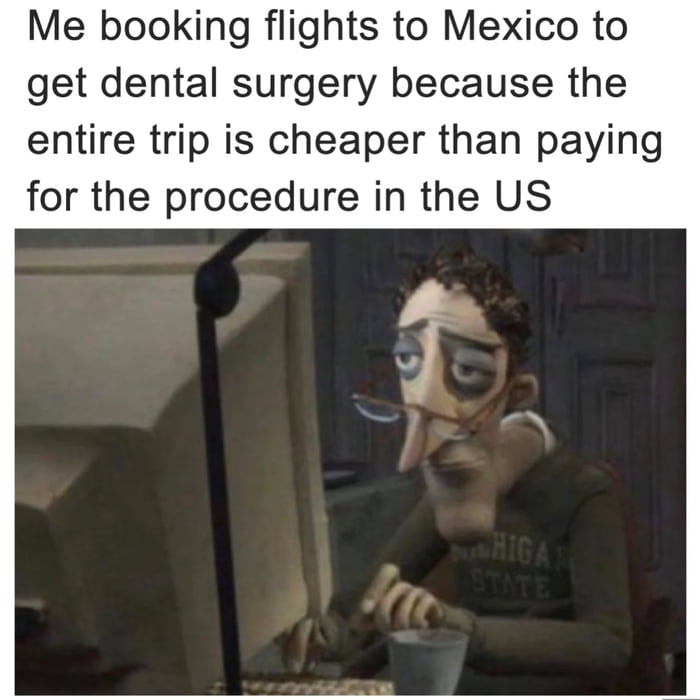
You are a GUI agent. You are given a task and a screenshot of the screen. Output one action in this format:
    pyautogui.click(x=<x>, y=<y>)
    Task: Click on the lamp stand
    Image resolution: width=700 pixels, height=700 pixels.
    Given the screenshot: What is the action you would take?
    pyautogui.click(x=220, y=290)